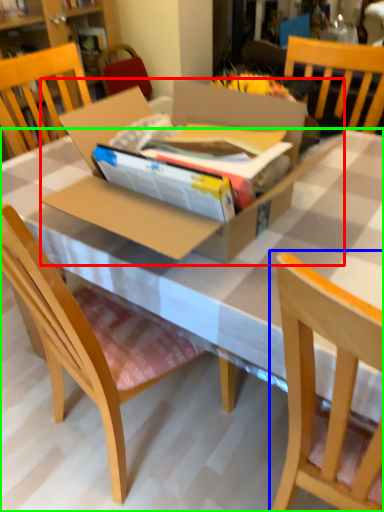
Question: Estimate the real-world distances between objects in this image. Which object is closer to cardboard box (highlighted by a red box), chair (highlighted by a blue box) or desk (highlighted by a green box)?

Choices:
 (A) chair
 (B) desk

Answer: (B)